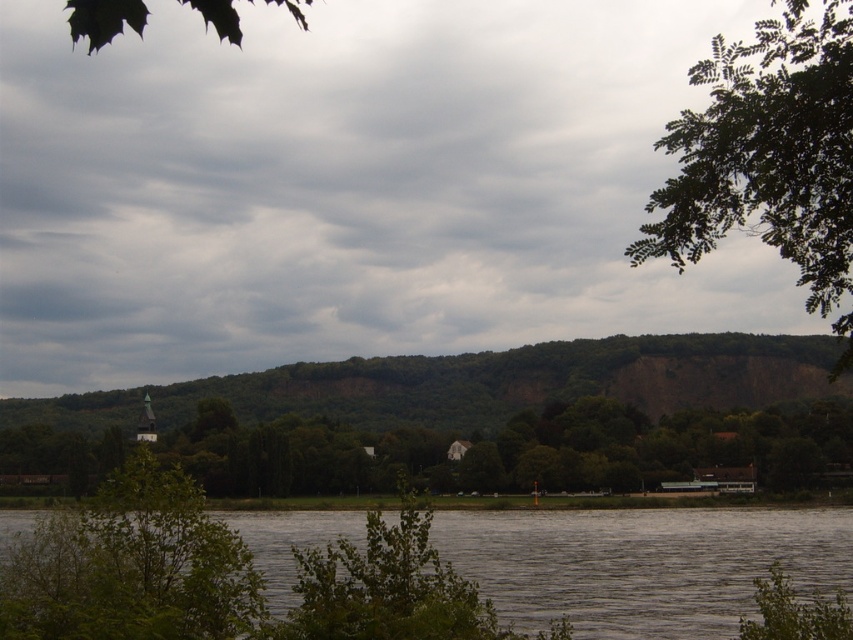
Between green leafy hill at center and green matte leaf at upper left, which one appears on the left side from the viewer's perspective?

green matte leaf at upper left is more to the left.

Locate an element on the screen. The height and width of the screenshot is (640, 853). green leafy hill at center is located at coordinates (474, 417).

Based on the photo, who is lower down, green leafy hill at center or gray water at lower center?

gray water at lower center is lower down.

Between green leafy hill at center and gray water at lower center, which one is positioned higher?

Positioned higher is green leafy hill at center.

Image resolution: width=853 pixels, height=640 pixels. Find the location of `green leafy hill at center`. green leafy hill at center is located at coordinates (474, 417).

Who is lower down, green leafy tree at upper right or green matte leaf at upper left?

Positioned lower is green leafy tree at upper right.

The height and width of the screenshot is (640, 853). In order to click on green leafy tree at upper right in this screenshot , I will do `click(767, 152)`.